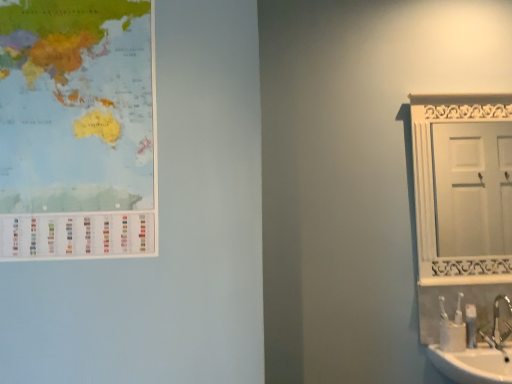
Describe the element at coordinates (473, 188) in the screenshot. I see `white wooden door at right` at that location.

This screenshot has height=384, width=512. I want to click on white wooden door at right, so click(x=473, y=188).

Identify the location of white plastic toothbrush at lower right. The height and width of the screenshot is (384, 512). (471, 325).

The image size is (512, 384). I want to click on matte paper map at upper left, so [x=77, y=129].

From the image's perspective, between white plastic toothbrush at lower right and white wooden door at right, which one is located above?

white wooden door at right appears higher in the image.

Which of these two, white plastic toothbrush at lower right or white wooden door at right, stands taller?

white wooden door at right is taller.

Which is more to the right, white wooden door at right or silver metallic faucet at lower right?

silver metallic faucet at lower right is more to the right.

Considering the relative sizes of white wooden door at right and silver metallic faucet at lower right in the image provided, is white wooden door at right wider than silver metallic faucet at lower right?

Incorrect, the width of white wooden door at right does not surpass that of silver metallic faucet at lower right.

Looking at this image, considering the sizes of objects white wooden door at right and silver metallic faucet at lower right in the image provided, who is smaller, white wooden door at right or silver metallic faucet at lower right?

Smaller between the two is silver metallic faucet at lower right.

Is white wooden door at right oriented towards silver metallic faucet at lower right?

No, white wooden door at right does not turn towards silver metallic faucet at lower right.

Is silver metallic faucet at lower right touching matte paper map at upper left?

silver metallic faucet at lower right and matte paper map at upper left are clearly separated.

From a real-world perspective, who is located higher, silver metallic faucet at lower right or matte paper map at upper left?

matte paper map at upper left is physically above.

Does point (497, 348) come in front of point (84, 158)?

No, (497, 348) is further to viewer.

What's the angular difference between silver metallic faucet at lower right and matte paper map at upper left's facing directions?

The facing directions of silver metallic faucet at lower right and matte paper map at upper left are 0.72 degrees apart.

Does white wooden door at right appear on the right side of matte paper map at upper left?

Yes.

From the image's perspective, between white wooden door at right and matte paper map at upper left, who is located below?

white wooden door at right.

Does white wooden door at right have a smaller size compared to matte paper map at upper left?

No, white wooden door at right is not smaller than matte paper map at upper left.

Is white plastic toothbrush at lower right positioned far away from matte paper map at upper left?

That's right, there is a large distance between white plastic toothbrush at lower right and matte paper map at upper left.

From the image's perspective, is white plastic toothbrush at lower right above or below matte paper map at upper left?

Clearly, from the image's perspective, white plastic toothbrush at lower right is below matte paper map at upper left.

Which object is positioned more to the right, white plastic toothbrush at lower right or matte paper map at upper left?

white plastic toothbrush at lower right.

Is the position of white plastic toothbrush at lower right more distant than that of matte paper map at upper left?

Yes, white plastic toothbrush at lower right is further from the camera.

Is silver metallic faucet at lower right looking in the opposite direction of white plastic toothbrush at lower right?

That's not correct — silver metallic faucet at lower right is not looking away from white plastic toothbrush at lower right.

Locate an element on the screen. The height and width of the screenshot is (384, 512). toiletry below the silver metallic faucet at lower right (from the image's perspective) is located at coordinates (471, 325).

Which is behind, silver metallic faucet at lower right or white plastic toothbrush at lower right?

white plastic toothbrush at lower right is more distant.

Considering the points (497, 318) and (469, 343), which point is behind, point (497, 318) or point (469, 343)?

Point (497, 318)

Is matte paper map at upper left behind white plastic toothbrush at lower right?

That is False.

How far apart are matte paper map at upper left and white plastic toothbrush at lower right?

A distance of 1.67 meters exists between matte paper map at upper left and white plastic toothbrush at lower right.

What's the angular difference between matte paper map at upper left and white plastic toothbrush at lower right's facing directions?

2.54 degrees.

Does point (122, 136) come behind point (473, 320)?

No, (122, 136) is closer to viewer.

Locate an element on the screen. The image size is (512, 384). door that is behind the white plastic toothbrush at lower right is located at coordinates (473, 188).

What are the coordinates of `tap that appears on the right of white wooden door at right` in the screenshot? It's located at (498, 325).

From the image, which object appears to be nearer to silver metallic faucet at lower right, white wooden door at right or white plastic toothbrush at lower right?

white plastic toothbrush at lower right is positioned closer to the anchor silver metallic faucet at lower right.

Estimate the real-world distances between objects in this image. Which object is further from white plastic toothbrush at lower right, white wooden door at right or matte paper map at upper left?

matte paper map at upper left lies further to white plastic toothbrush at lower right than the other object.

Estimate the real-world distances between objects in this image. Which object is further from matte paper map at upper left, white wooden door at right or white plastic toothbrush at lower right?

white wooden door at right.

Which object lies nearer to the anchor point matte paper map at upper left, white wooden door at right or silver metallic faucet at lower right?

silver metallic faucet at lower right is positioned closer to the anchor matte paper map at upper left.

Based on their spatial positions, is matte paper map at upper left or white plastic toothbrush at lower right further from silver metallic faucet at lower right?

Among the two, matte paper map at upper left is located further to silver metallic faucet at lower right.

Considering their positions, is matte paper map at upper left positioned closer to white plastic toothbrush at lower right than silver metallic faucet at lower right?

silver metallic faucet at lower right is positioned closer to the anchor white plastic toothbrush at lower right.

Which object lies nearer to the anchor point matte paper map at upper left, silver metallic faucet at lower right or white wooden door at right?

silver metallic faucet at lower right.

When comparing their distances from white wooden door at right, does white plastic toothbrush at lower right or silver metallic faucet at lower right seem further?

white plastic toothbrush at lower right is further to white wooden door at right.

Find the location of a particular element. This screenshot has height=384, width=512. tap between white wooden door at right and white plastic toothbrush at lower right vertically is located at coordinates (498, 325).

The width and height of the screenshot is (512, 384). What are the coordinates of `toiletry between matte paper map at upper left and white wooden door at right from left to right` in the screenshot? It's located at (471, 325).

The height and width of the screenshot is (384, 512). Find the location of `toiletry between matte paper map at upper left and silver metallic faucet at lower right in the horizontal direction`. toiletry between matte paper map at upper left and silver metallic faucet at lower right in the horizontal direction is located at coordinates (x=471, y=325).

The width and height of the screenshot is (512, 384). Identify the location of door between matte paper map at upper left and silver metallic faucet at lower right from left to right. (473, 188).